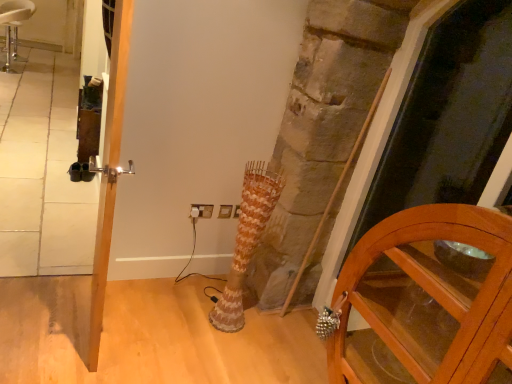
Identify the location of vacant space in front of polished silver door handle at left. The height and width of the screenshot is (384, 512). (64, 351).